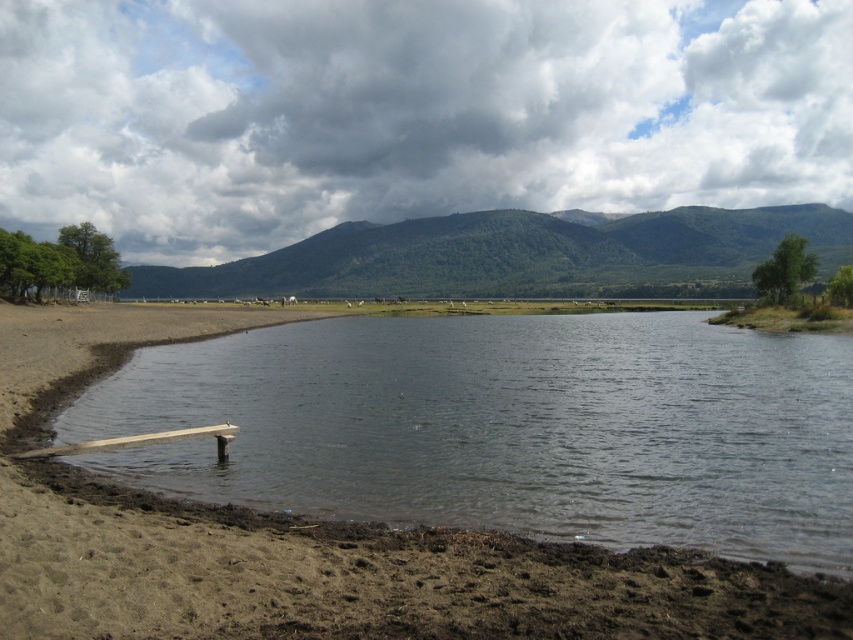
Question: Does brown sandy beach at lower left have a greater width compared to green forested mountain at center?

Choices:
 (A) no
 (B) yes

Answer: (A)

Question: Which of the following is the closest to the observer?

Choices:
 (A) brown sandy beach at lower left
 (B) green forested mountain at center

Answer: (A)

Question: Does brown sandy beach at lower left appear on the left side of green forested mountain at center?

Choices:
 (A) yes
 (B) no

Answer: (A)

Question: Among these objects, which one is farthest from the camera?

Choices:
 (A) green forested mountain at center
 (B) brown sandy beach at lower left

Answer: (A)

Question: Where is brown sandy beach at lower left located in relation to green forested mountain at center in the image?

Choices:
 (A) above
 (B) below

Answer: (B)